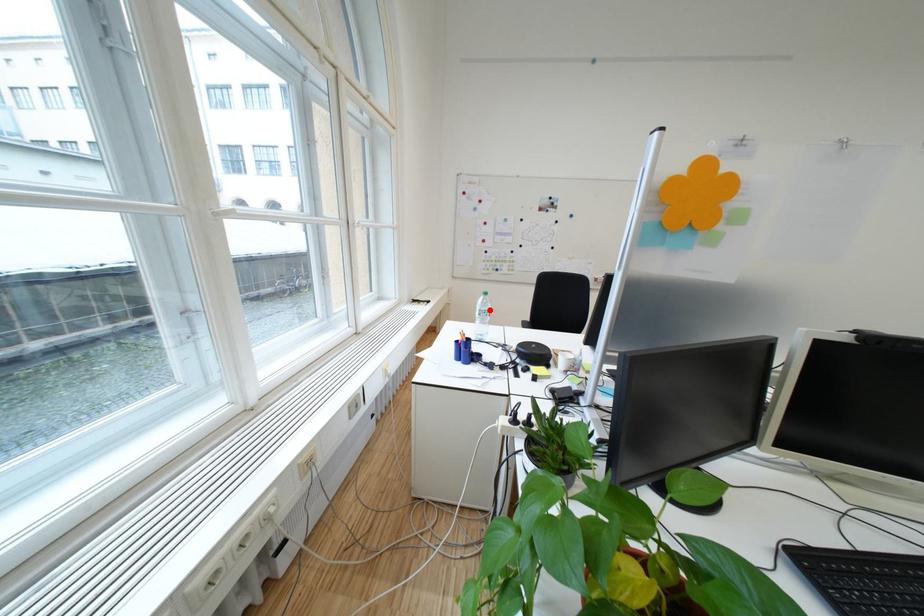
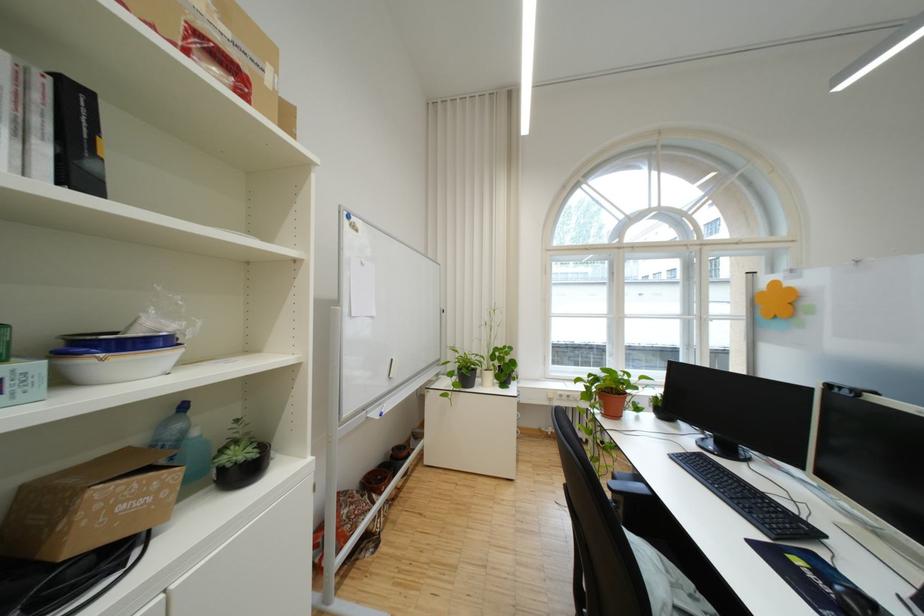
Question: I am providing you with two images of the same scene from different viewpoints. A red point is marked on the first image. Can you still see the location of the red point in image 2?

Choices:
 (A) Yes
 (B) No

Answer: (B)